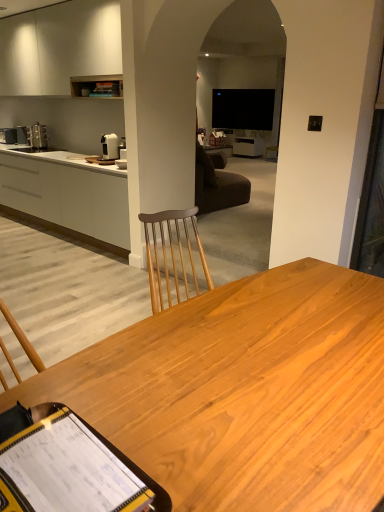
Question: From the image's perspective, would you say white matte cabinet at upper left, which appears as the 1th cabinetry when viewed from the top, is positioned over white matte cabinetry at left, the 2th cabinetry when ordered from top to bottom?

Choices:
 (A) no
 (B) yes

Answer: (B)

Question: From a real-world perspective, is white matte cabinet at upper left, the second cabinetry in the bottom-to-top sequence, on white matte cabinetry at left, the 1th cabinetry when ordered from bottom to top?

Choices:
 (A) yes
 (B) no

Answer: (A)

Question: Could you tell me if white matte cabinet at upper left, which appears as the 1th cabinetry when viewed from the top, is turned towards white matte cabinetry at left, the 1th cabinetry when ordered from bottom to top?

Choices:
 (A) yes
 (B) no

Answer: (B)

Question: Is the depth of white matte cabinet at upper left, the second cabinetry in the bottom-to-top sequence, greater than that of white matte cabinetry at left, the 2th cabinetry when ordered from top to bottom?

Choices:
 (A) no
 (B) yes

Answer: (A)

Question: Does white matte cabinet at upper left, which appears as the 1th cabinetry when viewed from the top, have a larger size compared to white matte cabinetry at left, the 1th cabinetry when ordered from bottom to top?

Choices:
 (A) yes
 (B) no

Answer: (B)

Question: Is white glossy coffee machine at upper left, the 2th coffee machine when ordered from top to bottom, wider or thinner than white matte cabinet at upper left, which appears as the 1th cabinetry when viewed from the top?

Choices:
 (A) thin
 (B) wide

Answer: (A)

Question: Is white glossy coffee machine at upper left, the 2th coffee machine viewed from the left, to the left or to the right of white matte cabinet at upper left, the second cabinetry in the bottom-to-top sequence, in the image?

Choices:
 (A) left
 (B) right

Answer: (B)

Question: From a real-world perspective, is white glossy coffee machine at upper left, which is counted as the second coffee machine, starting from the back, positioned above or below white matte cabinet at upper left, which appears as the 1th cabinetry when viewed from the top?

Choices:
 (A) above
 (B) below

Answer: (B)

Question: From their relative heights in the image, would you say white glossy coffee machine at upper left, marked as the 1th coffee machine in a bottom-to-top arrangement, is taller or shorter than white matte cabinet at upper left, the second cabinetry in the bottom-to-top sequence?

Choices:
 (A) tall
 (B) short

Answer: (B)

Question: From a real-world perspective, relative to white matte cabinet at upper left, the second cabinetry in the bottom-to-top sequence, is satin silver coffee machine at left, marked as the 1th coffee machine in a back-to-front arrangement, vertically above or below?

Choices:
 (A) below
 (B) above

Answer: (A)

Question: Is satin silver coffee machine at left, marked as the 1th coffee machine in a back-to-front arrangement, bigger or smaller than white matte cabinet at upper left, the second cabinetry in the bottom-to-top sequence?

Choices:
 (A) big
 (B) small

Answer: (B)

Question: Considering their positions, is satin silver coffee machine at left, marked as the 1th coffee machine in a back-to-front arrangement, located in front of or behind white matte cabinet at upper left, which appears as the 1th cabinetry when viewed from the top?

Choices:
 (A) front
 (B) behind

Answer: (B)

Question: From the image's perspective, is satin silver coffee machine at left, positioned as the second coffee machine in bottom-to-top order, located above or below white matte cabinet at upper left, the second cabinetry in the bottom-to-top sequence?

Choices:
 (A) above
 (B) below

Answer: (B)

Question: From a real-world perspective, is white glossy coffee machine at upper left, which is the first coffee machine in front-to-back order, positioned above or below white matte cabinetry at left, the 2th cabinetry when ordered from top to bottom?

Choices:
 (A) above
 (B) below

Answer: (A)

Question: Is white glossy coffee machine at upper left, marked as the 1th coffee machine in a bottom-to-top arrangement, bigger or smaller than white matte cabinetry at left, the 1th cabinetry when ordered from bottom to top?

Choices:
 (A) big
 (B) small

Answer: (B)